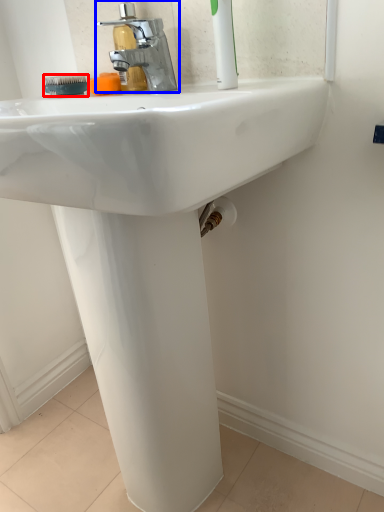
Question: Which of the following is the farthest to the observer, brush (highlighted by a red box) or tap (highlighted by a blue box)?

Choices:
 (A) brush
 (B) tap

Answer: (A)